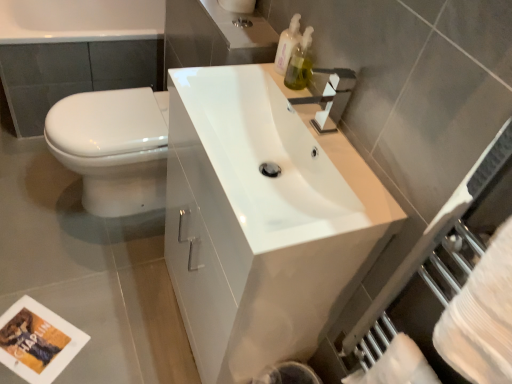
Question: From the image's perspective, is white glossy sink at center under translucent plastic soap dispenser at upper right, arranged as the 1th soap dispenser when viewed from the top?

Choices:
 (A) no
 (B) yes

Answer: (B)

Question: Is white glossy sink at center taller than translucent plastic soap dispenser at upper right, the 2th soap dispenser from the bottom?

Choices:
 (A) no
 (B) yes

Answer: (B)

Question: From the image's perspective, is white glossy sink at center located above translucent plastic soap dispenser at upper right, arranged as the 1th soap dispenser when viewed from the top?

Choices:
 (A) no
 (B) yes

Answer: (A)

Question: Can you confirm if white glossy sink at center is smaller than translucent plastic soap dispenser at upper right, the 2th soap dispenser from the bottom?

Choices:
 (A) no
 (B) yes

Answer: (A)

Question: Does white glossy sink at center lie in front of translucent plastic soap dispenser at upper right, arranged as the 1th soap dispenser when viewed from the top?

Choices:
 (A) yes
 (B) no

Answer: (A)

Question: Would you say matte silver faucet at upper center is to the left or to the right of white glossy toilet at left in the picture?

Choices:
 (A) right
 (B) left

Answer: (A)

Question: Considering the positions of matte silver faucet at upper center and white glossy toilet at left in the image, is matte silver faucet at upper center taller or shorter than white glossy toilet at left?

Choices:
 (A) tall
 (B) short

Answer: (B)

Question: Considering the positions of matte silver faucet at upper center and white glossy toilet at left in the image, is matte silver faucet at upper center wider or thinner than white glossy toilet at left?

Choices:
 (A) thin
 (B) wide

Answer: (A)

Question: Is matte silver faucet at upper center spatially inside white glossy toilet at left, or outside of it?

Choices:
 (A) outside
 (B) inside

Answer: (A)

Question: Would you say translucent plastic soap dispenser at upper right, arranged as the 1th soap dispenser when viewed from the top, is inside or outside white paper towel at lower right, arranged as the second toilet paper when viewed from the top?

Choices:
 (A) outside
 (B) inside

Answer: (A)

Question: Is translucent plastic soap dispenser at upper right, arranged as the 1th soap dispenser when viewed from the top, taller or shorter than white paper towel at lower right, arranged as the second toilet paper when viewed from the top?

Choices:
 (A) short
 (B) tall

Answer: (A)

Question: From a real-world perspective, is translucent plastic soap dispenser at upper right, arranged as the 1th soap dispenser when viewed from the top, positioned above or below white paper towel at lower right, which is the first toilet paper in right-to-left order?

Choices:
 (A) below
 (B) above

Answer: (B)

Question: Relative to white paper towel at lower right, marked as the first toilet paper in a front-to-back arrangement, is translucent plastic soap dispenser at upper right, arranged as the 1th soap dispenser when viewed from the top, in front or behind?

Choices:
 (A) behind
 (B) front

Answer: (A)

Question: Would you say white glossy sink at center is to the left or to the right of white glossy bathtub at upper left in the picture?

Choices:
 (A) right
 (B) left

Answer: (A)

Question: Is point (352, 226) closer or farther from the camera than point (109, 26)?

Choices:
 (A) farther
 (B) closer

Answer: (B)